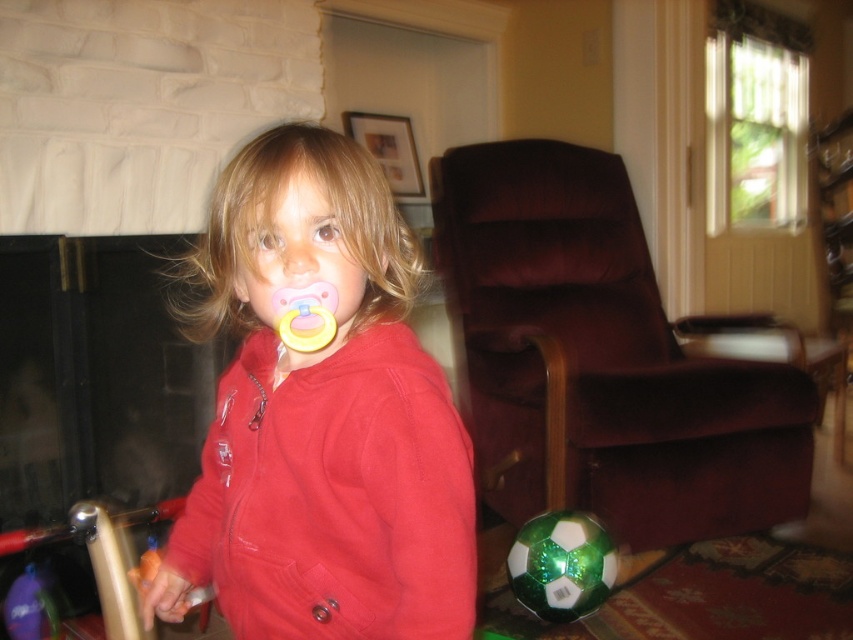
You are a parent holding a baby who is currently crying. The baby is holding the pink rubber pacifier at center. You want to place the baby into the velvet brown armchair at right to comfort them. Is the distance between the pacifier and the armchair sufficient for you to walk over and place the baby there comfortably?

The distance between the velvet brown armchair at right and the pink rubber pacifier at center is 5.80 feet, which is more than enough space for a parent to comfortably walk over and place the baby in the chair.